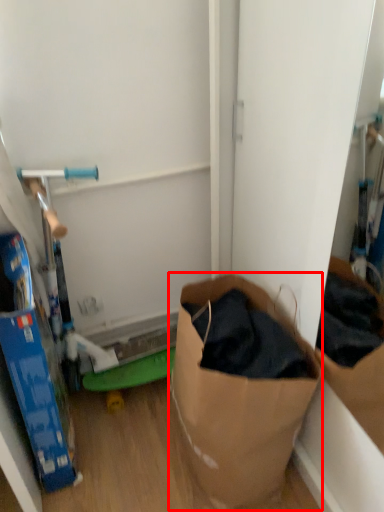
Question: From the image's perspective, what is the correct spatial positioning of paper bag (annotated by the red box) in reference to box?

Choices:
 (A) below
 (B) above

Answer: (A)